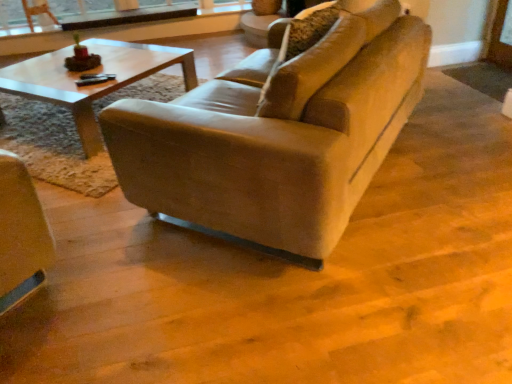
Question: From a real-world perspective, relative to matte brown armchair at upper left, is leather couch at center vertically above or below?

Choices:
 (A) below
 (B) above

Answer: (B)

Question: From the image's perspective, relative to matte brown armchair at upper left, is leather couch at center above or below?

Choices:
 (A) below
 (B) above

Answer: (A)

Question: Estimate the real-world distances between objects in this image. Which object is farther from the leather couch at center?

Choices:
 (A) clear glass window frame at upper center
 (B) matte brown armchair at upper left

Answer: (B)

Question: Considering the real-world distances, which object is farthest from the leather couch at center?

Choices:
 (A) clear glass window frame at upper center
 (B) matte brown armchair at upper left

Answer: (B)